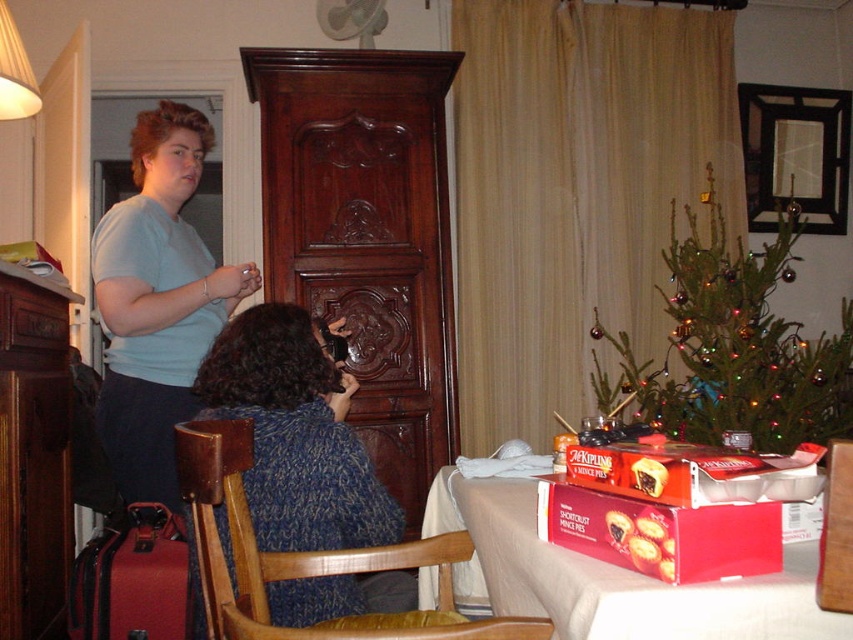
Question: Among these objects, which one is farthest from the camera?

Choices:
 (A) dark wood armoire at center
 (B) white cloth table at lower right
 (C) green matte christmas tree at right

Answer: (C)

Question: Is light blue t-shirt at upper left closer to camera compared to dark wood armoire at center?

Choices:
 (A) yes
 (B) no

Answer: (B)

Question: Does green matte christmas tree at right lie in front of white cloth table at lower right?

Choices:
 (A) no
 (B) yes

Answer: (A)

Question: Is white cloth table at lower right below dark wood armoire at center?

Choices:
 (A) yes
 (B) no

Answer: (A)

Question: Which object is the farthest from the blue knitted sweater at center?

Choices:
 (A) green matte christmas tree at right
 (B) white cloth table at lower right
 (C) dark wood armoire at center
 (D) light blue t-shirt at upper left

Answer: (A)

Question: Among these objects, which one is nearest to the camera?

Choices:
 (A) light blue t-shirt at upper left
 (B) blue knitted sweater at center
 (C) green matte christmas tree at right

Answer: (B)